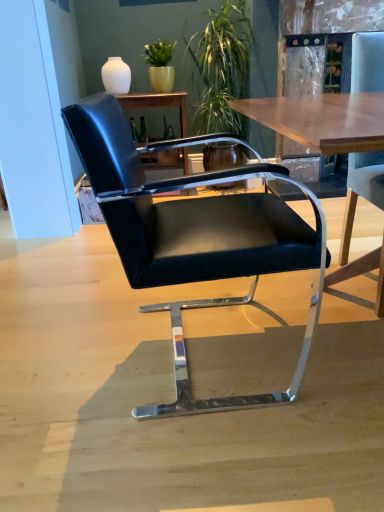
Question: From the image's perspective, is black leather chair at center, the second chair viewed from the right, under black leather chair at right, which appears as the first chair when viewed from the right?

Choices:
 (A) no
 (B) yes

Answer: (B)

Question: Considering the relative positions of black leather chair at center, the 1th chair in the left-to-right sequence, and black leather chair at right, the 2th chair when ordered from left to right, in the image provided, is black leather chair at center, the 1th chair in the left-to-right sequence, to the left of black leather chair at right, the 2th chair when ordered from left to right, from the viewer's perspective?

Choices:
 (A) no
 (B) yes

Answer: (B)

Question: Would you say black leather chair at center, the 1th chair in the left-to-right sequence, contains black leather chair at right, the 2th chair when ordered from left to right?

Choices:
 (A) yes
 (B) no

Answer: (B)

Question: Is black leather chair at center, the 1th chair in the left-to-right sequence, directly adjacent to black leather chair at right, which appears as the first chair when viewed from the right?

Choices:
 (A) yes
 (B) no

Answer: (B)

Question: Is black leather chair at center, the second chair viewed from the right, not near black leather chair at right, the 2th chair when ordered from left to right?

Choices:
 (A) yes
 (B) no

Answer: (B)

Question: In the image, is black leather chair at center, the second chair viewed from the right, on the left side or the right side of matte black chair at center?

Choices:
 (A) right
 (B) left

Answer: (A)

Question: From the image's perspective, is black leather chair at center, the second chair viewed from the right, positioned above or below matte black chair at center?

Choices:
 (A) below
 (B) above

Answer: (A)

Question: From their relative heights in the image, would you say black leather chair at center, the second chair viewed from the right, is taller or shorter than matte black chair at center?

Choices:
 (A) tall
 (B) short

Answer: (A)

Question: From a real-world perspective, is black leather chair at center, the second chair viewed from the right, above or below matte black chair at center?

Choices:
 (A) below
 (B) above

Answer: (A)

Question: Considering the positions of black leather chair at right, which appears as the first chair when viewed from the right, and matte black chair at center in the image, is black leather chair at right, which appears as the first chair when viewed from the right, wider or thinner than matte black chair at center?

Choices:
 (A) thin
 (B) wide

Answer: (B)

Question: Is black leather chair at right, which appears as the first chair when viewed from the right, in front of or behind matte black chair at center in the image?

Choices:
 (A) behind
 (B) front

Answer: (B)

Question: From the image's perspective, is black leather chair at right, which appears as the first chair when viewed from the right, located above or below matte black chair at center?

Choices:
 (A) below
 (B) above

Answer: (A)

Question: From a real-world perspective, is black leather chair at right, which appears as the first chair when viewed from the right, above or below matte black chair at center?

Choices:
 (A) below
 (B) above

Answer: (A)

Question: Relative to green leafy plant at upper center, is matte black chair at center in front or behind?

Choices:
 (A) behind
 (B) front

Answer: (A)

Question: From a real-world perspective, relative to green leafy plant at upper center, is matte black chair at center vertically above or below?

Choices:
 (A) below
 (B) above

Answer: (A)